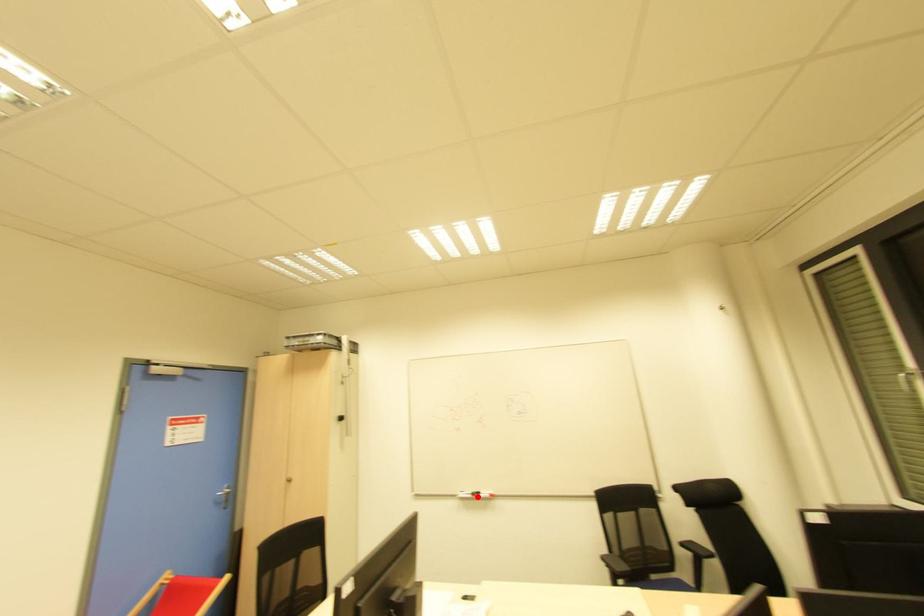
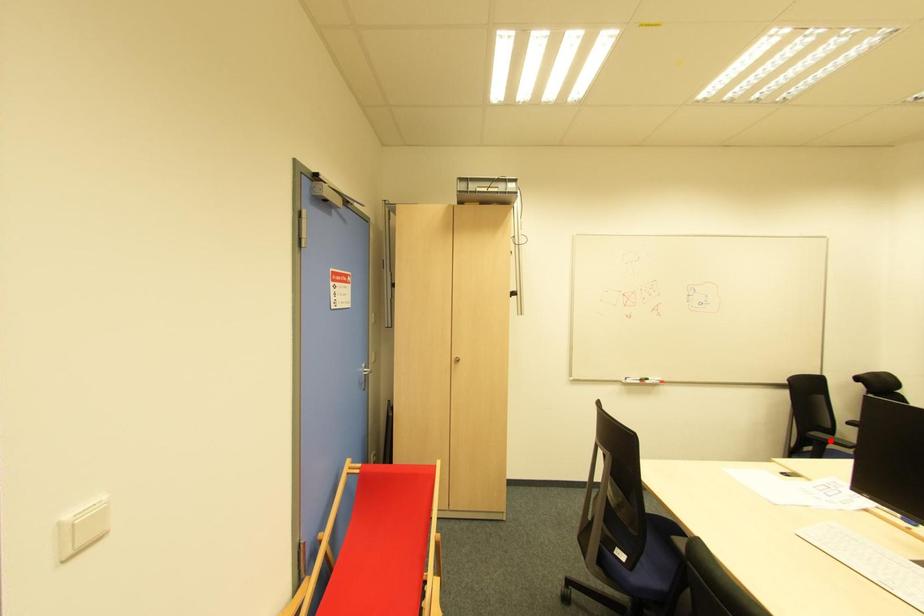
I am providing you with two images of the same scene from different viewpoints. A red point is marked on the first image and another point is marked on the second image. Do the highlighted points in image1 and image2 indicate the same real-world spot?

No